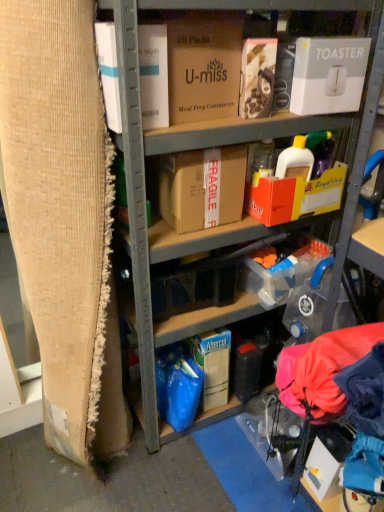
What do you see at coordinates (204, 65) in the screenshot? I see `brown cardboard box at upper center, which ranks as the 3th box in right-to-left order` at bounding box center [204, 65].

Locate an element on the screen. The image size is (384, 512). brown cardboard box at upper center, which ranks as the 3th box in right-to-left order is located at coordinates (204, 65).

What are the coordinates of `white cardboard toaster at upper right, the fourth box positioned from the left` in the screenshot? It's located at (328, 75).

Between white cardboard toaster at upper right, acting as the first box starting from the right, and brown cardboard at left, which one is positioned behind?

white cardboard toaster at upper right, acting as the first box starting from the right, is behind.

At what (x,y) coordinates should I click in order to perform the action: click on cardboard that is on the left side of white cardboard toaster at upper right, acting as the first box starting from the right. Please return your answer as a coordinate pair (x, y). This screenshot has width=384, height=512. Looking at the image, I should click on (64, 219).

From the picture: From the image's perspective, is white cardboard toaster at upper right, acting as the first box starting from the right, located above or below brown cardboard at left?

From the image's perspective, white cardboard toaster at upper right, acting as the first box starting from the right, appears above brown cardboard at left.

From the picture: Is white cardboard toaster at upper right, acting as the first box starting from the right, situated inside brown cardboard at left or outside?

white cardboard toaster at upper right, acting as the first box starting from the right, exists outside the volume of brown cardboard at left.

Is brown cardboard at left turned away from white cardboard box at upper left, which is the 4th box from right to left?

No, brown cardboard at left is not facing the opposite direction of white cardboard box at upper left, which is the 4th box from right to left.

From the image's perspective, which is above, brown cardboard at left or white cardboard box at upper left, positioned as the 1th box in left-to-right order?

white cardboard box at upper left, positioned as the 1th box in left-to-right order, appears higher in the image.

From a real-world perspective, is brown cardboard at left positioned under white cardboard box at upper left, positioned as the 1th box in left-to-right order, based on gravity?

Yes, from a real-world perspective, brown cardboard at left is beneath white cardboard box at upper left, positioned as the 1th box in left-to-right order.

Are brown cardboard at left and white cardboard box at upper left, positioned as the 1th box in left-to-right order, beside each other?

No, brown cardboard at left is not next to white cardboard box at upper left, positioned as the 1th box in left-to-right order.

Is brown cardboard box at center, arranged as the 2th box when viewed from the right, aimed at white cardboard box at upper left, positioned as the 1th box in left-to-right order?

No.

Between brown cardboard box at center, which appears as the 3th box when viewed from the left, and white cardboard box at upper left, which is the 4th box from right to left, which one has larger width?

Wider between the two is brown cardboard box at center, which appears as the 3th box when viewed from the left.

Is the position of brown cardboard box at center, arranged as the 2th box when viewed from the right, more distant than that of white cardboard box at upper left, which is the 4th box from right to left?

Yes.

Is blue plastic storage box at lower center turned away from brown cardboard at left?

blue plastic storage box at lower center is not turned away from brown cardboard at left.

Is blue plastic storage box at lower center taller or shorter than brown cardboard at left?

Clearly, blue plastic storage box at lower center is shorter compared to brown cardboard at left.

Between point (208, 359) and point (72, 161), which one is positioned in front?

The point (72, 161) is in front.

Find the location of a particular element. cardboard in front of the blue plastic storage box at lower center is located at coordinates (x=64, y=219).

From a real-world perspective, between white cardboard box at upper left, which is the 4th box from right to left, and brown cardboard box at upper center, marked as the 2th box in a left-to-right arrangement, who is vertically lower?

white cardboard box at upper left, which is the 4th box from right to left.

Can you confirm if white cardboard box at upper left, which is the 4th box from right to left, is shorter than brown cardboard box at upper center, which ranks as the 3th box in right-to-left order?

No, white cardboard box at upper left, which is the 4th box from right to left, is not shorter than brown cardboard box at upper center, which ranks as the 3th box in right-to-left order.

Is the surface of white cardboard box at upper left, which is the 4th box from right to left, in direct contact with brown cardboard box at upper center, which ranks as the 3th box in right-to-left order?

white cardboard box at upper left, which is the 4th box from right to left, and brown cardboard box at upper center, which ranks as the 3th box in right-to-left order, are clearly separated.

Who is bigger, white cardboard box at upper left, which is the 4th box from right to left, or brown cardboard box at upper center, marked as the 2th box in a left-to-right arrangement?

brown cardboard box at upper center, marked as the 2th box in a left-to-right arrangement, is bigger.

Is white cardboard toaster at upper right, the fourth box positioned from the left, located within white cardboard box at upper left, which is the 4th box from right to left?

No, white cardboard toaster at upper right, the fourth box positioned from the left, is not surrounded by white cardboard box at upper left, which is the 4th box from right to left.

Considering the relative sizes of white cardboard box at upper left, positioned as the 1th box in left-to-right order, and white cardboard toaster at upper right, the fourth box positioned from the left, in the image provided, is white cardboard box at upper left, positioned as the 1th box in left-to-right order, smaller than white cardboard toaster at upper right, the fourth box positioned from the left,?

Correct, white cardboard box at upper left, positioned as the 1th box in left-to-right order, occupies less space than white cardboard toaster at upper right, the fourth box positioned from the left.

Is white cardboard box at upper left, which is the 4th box from right to left, shorter than white cardboard toaster at upper right, the fourth box positioned from the left?

No.

Where is `the 3rd box to the left when counting from the white cardboard toaster at upper right, acting as the first box starting from the right`? The image size is (384, 512). the 3rd box to the left when counting from the white cardboard toaster at upper right, acting as the first box starting from the right is located at coordinates (153, 75).

Considering the relative positions of white cardboard box at upper left, which is the 4th box from right to left, and blue plastic storage box at lower center in the image provided, is white cardboard box at upper left, which is the 4th box from right to left, to the left or to the right of blue plastic storage box at lower center?

Based on their positions, white cardboard box at upper left, which is the 4th box from right to left, is located to the left of blue plastic storage box at lower center.

Is white cardboard box at upper left, positioned as the 1th box in left-to-right order, further to the viewer compared to blue plastic storage box at lower center?

No, white cardboard box at upper left, positioned as the 1th box in left-to-right order, is closer to the camera.

From a real-world perspective, is white cardboard box at upper left, which is the 4th box from right to left, under blue plastic storage box at lower center?

No, from a real-world perspective, white cardboard box at upper left, which is the 4th box from right to left, is not below blue plastic storage box at lower center.

From the image's perspective, is white cardboard box at upper left, which is the 4th box from right to left, on top of blue plastic storage box at lower center?

Yes, from the image's perspective, white cardboard box at upper left, which is the 4th box from right to left, is on top of blue plastic storage box at lower center.

Image resolution: width=384 pixels, height=512 pixels. What are the coordinates of `the 3rd box behind the brown cardboard at left` in the screenshot? It's located at (328, 75).

Locate an element on the screen. The width and height of the screenshot is (384, 512). the 1st box to the right when counting from the brown cardboard at left is located at coordinates (153, 75).

Looking at the image, which one is located closer to blue plastic storage box at lower center, brown cardboard at left or brown cardboard box at center, arranged as the 2th box when viewed from the right?

brown cardboard at left.

Based on their spatial positions, is brown cardboard box at upper center, marked as the 2th box in a left-to-right arrangement, or cardboard boxes at center closer to brown cardboard box at center, which appears as the 3th box when viewed from the left?

Based on the image, cardboard boxes at center appears to be nearer to brown cardboard box at center, which appears as the 3th box when viewed from the left.

Considering their positions, is white cardboard toaster at upper right, the fourth box positioned from the left, positioned closer to blue plastic storage box at lower center than cardboard boxes at center?

cardboard boxes at center is closer to blue plastic storage box at lower center.

Which object lies further to the anchor point white cardboard toaster at upper right, the fourth box positioned from the left, cardboard boxes at center or white cardboard box at upper left, which is the 4th box from right to left?

Based on the image, white cardboard box at upper left, which is the 4th box from right to left, appears to be further to white cardboard toaster at upper right, the fourth box positioned from the left.

Which object lies nearer to the anchor point brown cardboard box at upper center, which ranks as the 3th box in right-to-left order, brown cardboard box at center, arranged as the 2th box when viewed from the right, or cardboard boxes at center?

cardboard boxes at center is closer to brown cardboard box at upper center, which ranks as the 3th box in right-to-left order.

Considering their positions, is white cardboard box at upper left, which is the 4th box from right to left, positioned further to cardboard boxes at center than blue plastic storage box at lower center?

Based on the image, blue plastic storage box at lower center appears to be further to cardboard boxes at center.

Looking at this image, estimate the real-world distances between objects in this image. Which object is further from white cardboard box at upper left, positioned as the 1th box in left-to-right order, white cardboard toaster at upper right, the fourth box positioned from the left, or brown cardboard at left?

white cardboard toaster at upper right, the fourth box positioned from the left, is positioned further to the anchor white cardboard box at upper left, positioned as the 1th box in left-to-right order.

Which object lies further to the anchor point brown cardboard box at center, arranged as the 2th box when viewed from the right, cardboard boxes at center or blue plastic storage box at lower center?

blue plastic storage box at lower center is further to brown cardboard box at center, arranged as the 2th box when viewed from the right.

Locate an element on the screen. This screenshot has height=512, width=384. cardboard between brown cardboard box at upper center, marked as the 2th box in a left-to-right arrangement, and blue plastic storage box at lower center, in the vertical direction is located at coordinates (64, 219).

Find the location of `shelf between brown cardboard box at upper center, marked as the 2th box in a left-to-right arrangement, and blue plastic storage box at lower center from top to bottom`. shelf between brown cardboard box at upper center, marked as the 2th box in a left-to-right arrangement, and blue plastic storage box at lower center from top to bottom is located at coordinates (171, 150).

Locate an element on the screen. This screenshot has height=512, width=384. shelf situated between brown cardboard at left and white cardboard toaster at upper right, acting as the first box starting from the right, from left to right is located at coordinates (171, 150).

What are the coordinates of `shelf that lies between white cardboard box at upper left, which is the 4th box from right to left, and blue plastic storage box at lower center from top to bottom` in the screenshot? It's located at (171, 150).